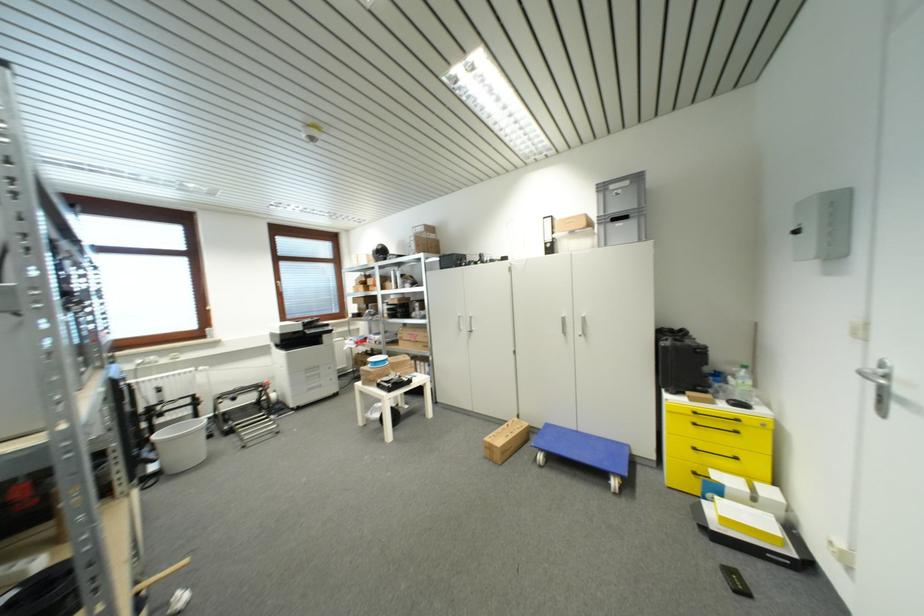
Which object does [743,384] point to?

This point indicates the clear water bottle.